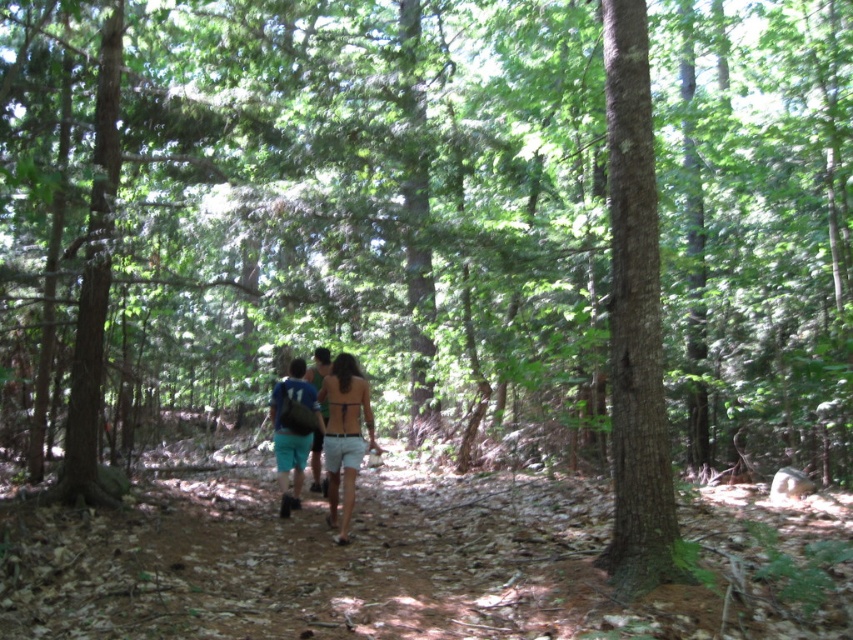
Between tan fabric bikini top at center and blue fabric backpack at center, which one appears on the left side from the viewer's perspective?

blue fabric backpack at center

Does tan fabric bikini top at center appear on the right side of blue fabric backpack at center?

Yes, tan fabric bikini top at center is to the right of blue fabric backpack at center.

Is point (363, 396) behind point (299, 419)?

No, it is in front of (299, 419).

Find the location of a particular element. Image resolution: width=853 pixels, height=640 pixels. tan fabric bikini top at center is located at coordinates (344, 435).

Can you confirm if tan fabric bikini top at center is positioned to the left of green fabric shorts at center?

Incorrect, tan fabric bikini top at center is not on the left side of green fabric shorts at center.

Is point (370, 432) positioned after point (314, 352)?

No, (370, 432) is closer to viewer.

Which is behind, point (344, 355) or point (320, 353)?

Positioned behind is point (320, 353).

I want to click on tan fabric bikini top at center, so click(344, 435).

Can you confirm if blue fabric backpack at center is taller than green fabric shorts at center?

Indeed, blue fabric backpack at center has a greater height compared to green fabric shorts at center.

Does blue fabric backpack at center appear on the left side of green fabric shorts at center?

Indeed, blue fabric backpack at center is positioned on the left side of green fabric shorts at center.

Where is `blue fabric backpack at center`? The image size is (853, 640). blue fabric backpack at center is located at coordinates (293, 429).

The height and width of the screenshot is (640, 853). I want to click on blue fabric backpack at center, so click(293, 429).